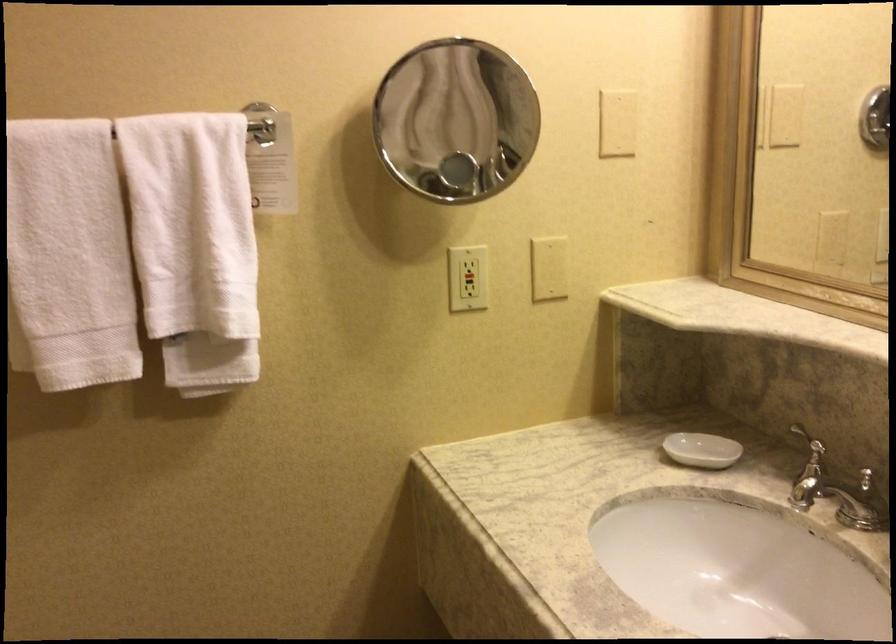
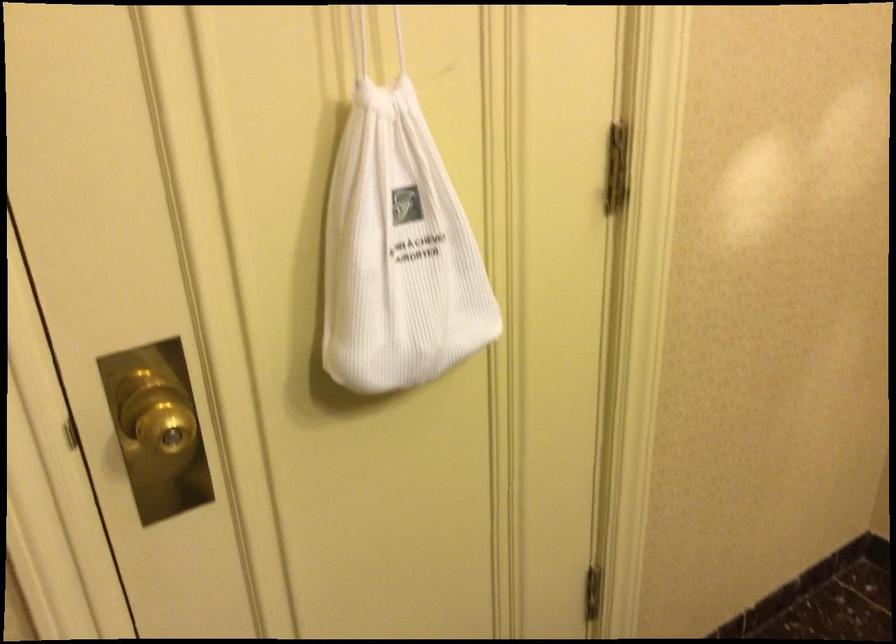
Based on the continuous images, in which direction is the camera rotating?

The camera's rotation is toward left-down.